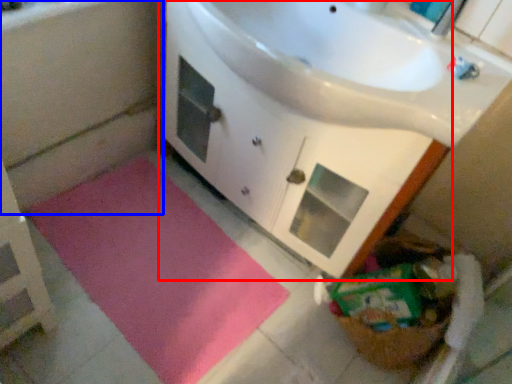
Question: Among these objects, which one is nearest to the camera, bathroom cabinet (highlighted by a red box) or bath (highlighted by a blue box)?

Choices:
 (A) bathroom cabinet
 (B) bath

Answer: (A)